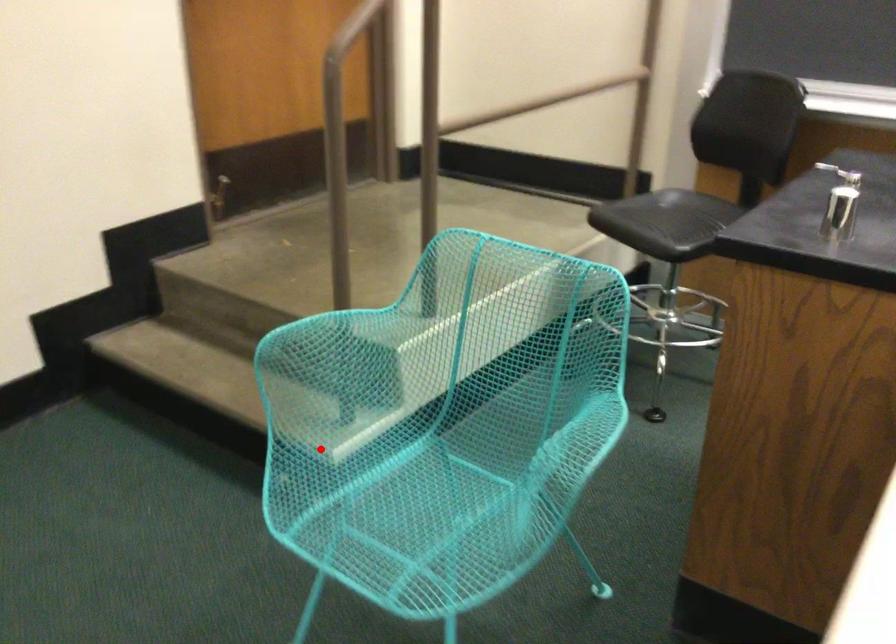
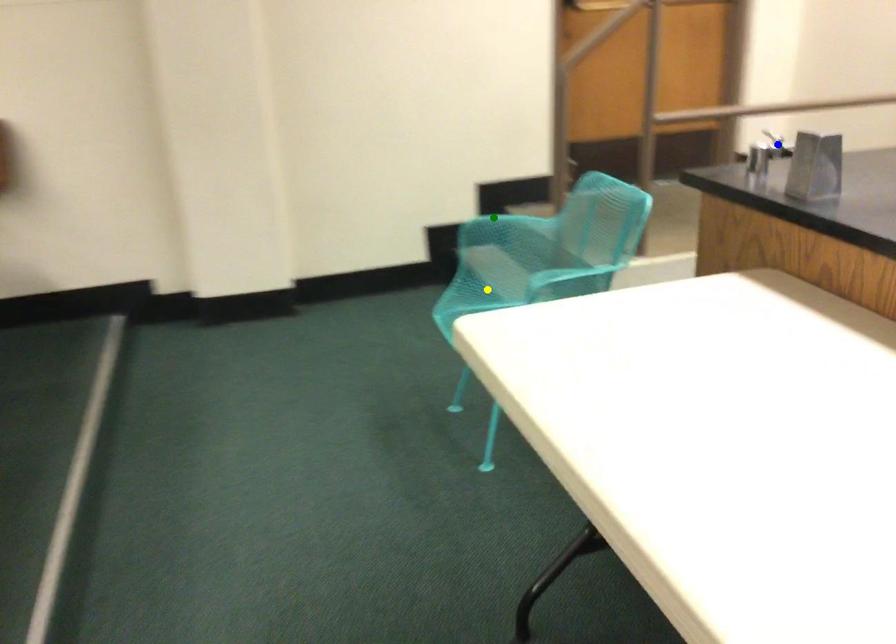
Question: I am providing you with two images of the same scene from different viewpoints. A red point is marked on the first image. You are given multiple points on the second image. Which point in image 2 represents the same 3d spot as the red point in image 1?

Choices:
 (A) green point
 (B) yellow point
 (C) blue point

Answer: (B)